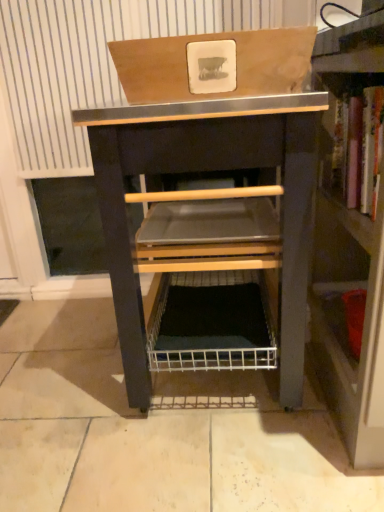
Locate an element on the screen. The height and width of the screenshot is (512, 384). free space in front of black metal/wooden vanity at center is located at coordinates (193, 462).